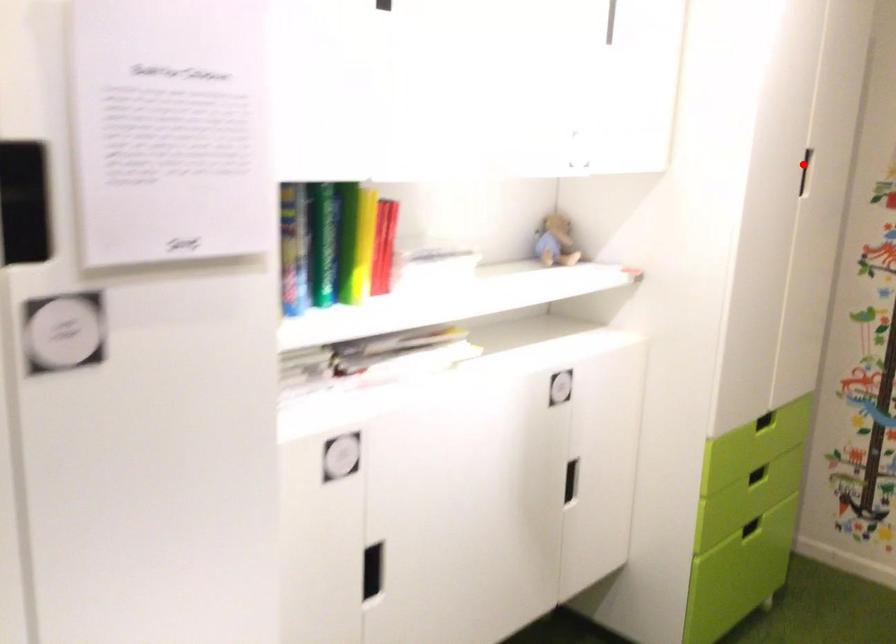
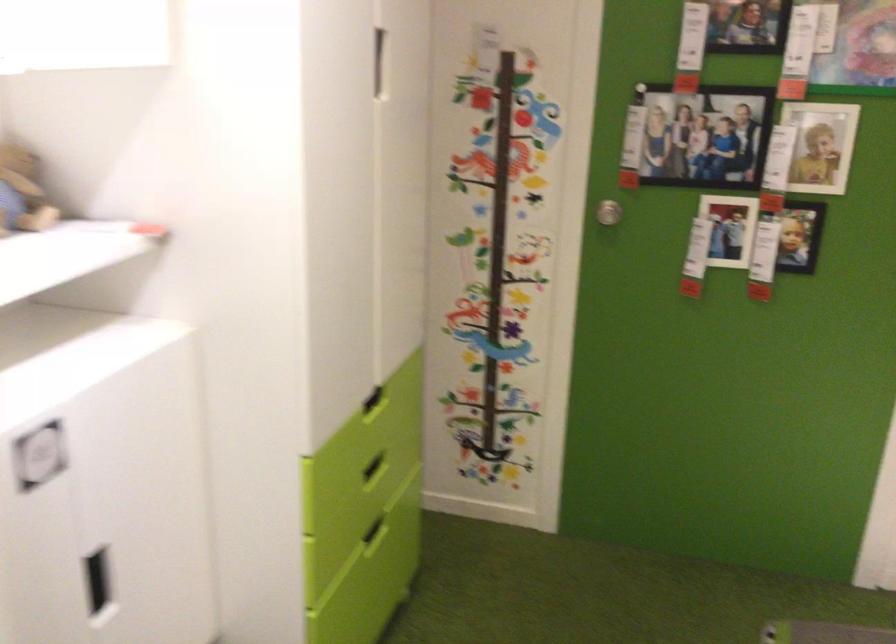
Question: I am providing you with two images of the same scene from different viewpoints. A red point is shown in image1. For the corresponding object point in image2, is it positioned nearer or farther from the camera?

Choices:
 (A) Nearer
 (B) Farther

Answer: (A)